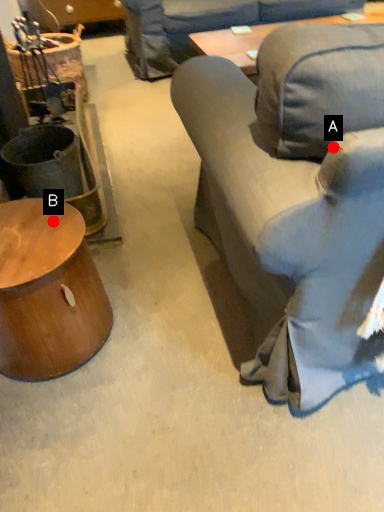
Question: Two points are circled on the image, labeled by A and B beside each circle. Among these points, which one is nearest to the camera?

Choices:
 (A) A is closer
 (B) B is closer

Answer: (A)